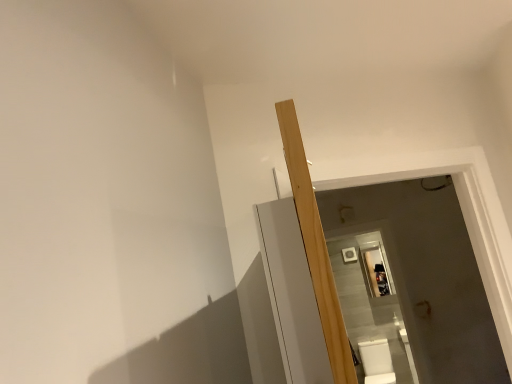
Locate an element on the screen. This screenshot has height=384, width=512. white glossy toilet bowl at lower right is located at coordinates (377, 362).

In the scene shown: Measure the distance between white glossy toilet bowl at lower right and camera.

They are 3.56 meters apart.

The width and height of the screenshot is (512, 384). Describe the element at coordinates (377, 362) in the screenshot. I see `white glossy toilet bowl at lower right` at that location.

What do you see at coordinates (315, 246) in the screenshot?
I see `light wood beam at center` at bounding box center [315, 246].

Find the location of a particular element. This screenshot has height=384, width=512. light wood beam at center is located at coordinates (315, 246).

This screenshot has width=512, height=384. What are the coordinates of `white glossy toilet bowl at lower right` in the screenshot? It's located at (377, 362).

Does light wood beam at center appear on the right side of white glossy toilet bowl at lower right?

Incorrect, light wood beam at center is not on the right side of white glossy toilet bowl at lower right.

Considering their positions, is light wood beam at center located in front of or behind white glossy toilet bowl at lower right?

light wood beam at center is in front of white glossy toilet bowl at lower right.

Is point (290, 179) closer or farther from the camera than point (383, 346)?

Point (290, 179) appears to be closer to the viewer than point (383, 346).

From the image's perspective, would you say light wood beam at center is positioned over white glossy toilet bowl at lower right?

Yes.

From a real-world perspective, is light wood beam at center positioned over white glossy toilet bowl at lower right based on gravity?

Yes, from a real-world perspective, light wood beam at center is on top of white glossy toilet bowl at lower right.

Which object is thinner, light wood beam at center or white glossy toilet bowl at lower right?

Thinner between the two is light wood beam at center.

Considering the sizes of objects light wood beam at center and white glossy toilet bowl at lower right in the image provided, who is shorter, light wood beam at center or white glossy toilet bowl at lower right?

white glossy toilet bowl at lower right.

Can you confirm if light wood beam at center is smaller than white glossy toilet bowl at lower right?

Indeed, light wood beam at center has a smaller size compared to white glossy toilet bowl at lower right.

Would you say light wood beam at center is outside white glossy toilet bowl at lower right?

light wood beam at center is positioned outside white glossy toilet bowl at lower right.

Would you consider light wood beam at center to be distant from white glossy toilet bowl at lower right?

Absolutely, light wood beam at center is distant from white glossy toilet bowl at lower right.

Is light wood beam at center looking in the opposite direction of white glossy toilet bowl at lower right?

light wood beam at center is not turned away from white glossy toilet bowl at lower right.

How different are the orientations of light wood beam at center and white glossy toilet bowl at lower right in degrees?

95.6 degrees separate the facing orientations of light wood beam at center and white glossy toilet bowl at lower right.

Measure the distance from light wood beam at center to white glossy toilet bowl at lower right.

A distance of 10.58 feet exists between light wood beam at center and white glossy toilet bowl at lower right.

This screenshot has width=512, height=384. What are the coordinates of `beam above the white glossy toilet bowl at lower right (from a real-world perspective)` in the screenshot? It's located at (315, 246).

Based on their positions, is white glossy toilet bowl at lower right located to the left or right of light wood beam at center?

white glossy toilet bowl at lower right is positioned on light wood beam at center's right side.

Does white glossy toilet bowl at lower right come behind light wood beam at center?

Yes, the depth of white glossy toilet bowl at lower right is greater than that of light wood beam at center.

Does point (374, 343) lie in front of point (321, 236)?

No, (374, 343) is behind (321, 236).

From the image's perspective, which object appears higher, white glossy toilet bowl at lower right or light wood beam at center?

light wood beam at center.

From a real-world perspective, is white glossy toilet bowl at lower right on light wood beam at center?

No, from a real-world perspective, white glossy toilet bowl at lower right is not on top of light wood beam at center.

Which of these two, white glossy toilet bowl at lower right or light wood beam at center, is thinner?

With smaller width is light wood beam at center.

Is white glossy toilet bowl at lower right taller than light wood beam at center?

No, white glossy toilet bowl at lower right is not taller than light wood beam at center.

In the scene shown: Who is bigger, white glossy toilet bowl at lower right or light wood beam at center?

white glossy toilet bowl at lower right is bigger.

Choose the correct answer: Is white glossy toilet bowl at lower right inside light wood beam at center or outside it?

white glossy toilet bowl at lower right is not inside light wood beam at center, it's outside.

Is white glossy toilet bowl at lower right next to light wood beam at center?

white glossy toilet bowl at lower right and light wood beam at center are not in contact.

Is white glossy toilet bowl at lower right facing towards light wood beam at center?

Yes, white glossy toilet bowl at lower right faces towards light wood beam at center.

From the picture: What's the angular difference between white glossy toilet bowl at lower right and light wood beam at center's facing directions?

white glossy toilet bowl at lower right and light wood beam at center are facing 95.6 degrees away from each other.

The height and width of the screenshot is (384, 512). I want to click on toilet bowl below the light wood beam at center (from a real-world perspective), so click(377, 362).

You are a GUI agent. You are given a task and a screenshot of the screen. Output one action in this format:
    pyautogui.click(x=<x>, y=<y>)
    Task: Click on the beam positioned vertically above the white glossy toilet bowl at lower right (from a real-world perspective)
    This screenshot has height=384, width=512.
    Given the screenshot: What is the action you would take?
    pyautogui.click(x=315, y=246)

This screenshot has height=384, width=512. I want to click on beam above the white glossy toilet bowl at lower right (from the image's perspective), so coord(315,246).